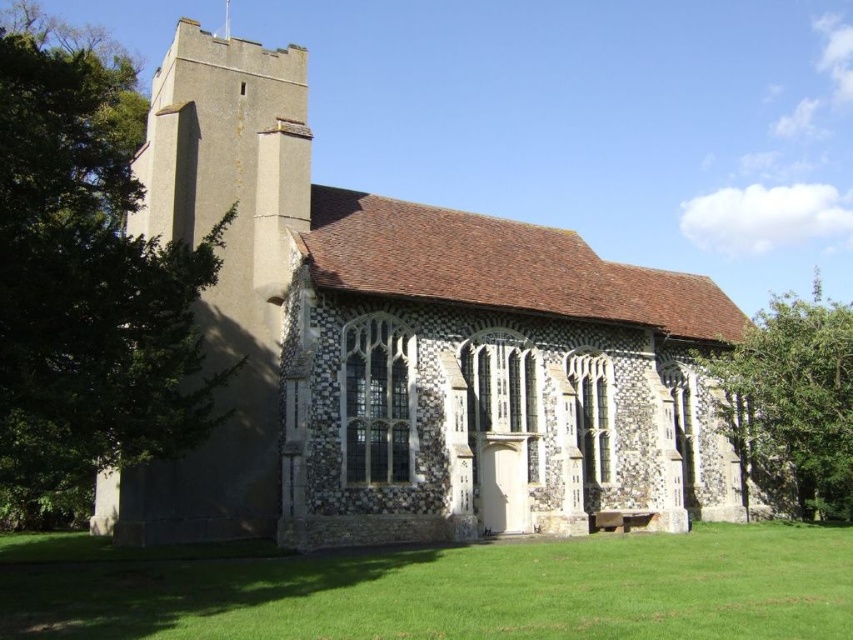
You are standing in a field and see the stone church at center and the green leafy tree at left. Which one appears larger in the image?

The green leafy tree at left appears larger than the stone church at center in the image.

You are standing in a field near the stone church at center and the green leafy tree at left. Which object is taller?

The green leafy tree at left is taller than the stone church at center.

You are standing at the entrance of the historic stone church and looking towards the green grass at lower center. Which direction should you walk to reach the green leafy tree at left?

The green leafy tree at left is to the left of green grass at lower center, so you should walk to the left to reach the green leafy tree at left.